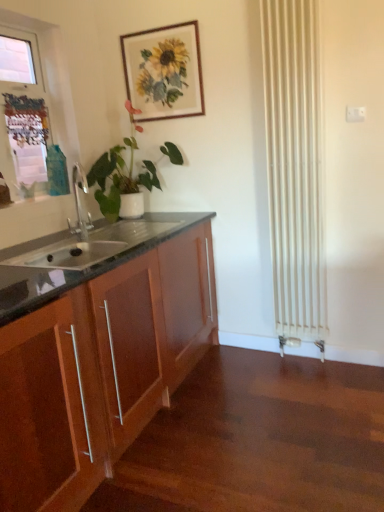
What do you see at coordinates (100, 362) in the screenshot? I see `wooden cabinet at left` at bounding box center [100, 362].

Where is `wooden picture frame at upper center`? This screenshot has width=384, height=512. wooden picture frame at upper center is located at coordinates (164, 71).

Locate an element on the screen. The image size is (384, 512). green matte plant at left is located at coordinates [119, 178].

Consider the image. Is white plastic window frame at upper left beside green matte plant at left?

No, white plastic window frame at upper left is not beside green matte plant at left.

Is white plastic window frame at upper left closer to the viewer compared to green matte plant at left?

Yes.

Does white plastic window frame at upper left turn towards green matte plant at left?

Yes, white plastic window frame at upper left is facing green matte plant at left.

How far apart are white plastic window frame at upper left and green matte plant at left?

The distance of white plastic window frame at upper left from green matte plant at left is 16.27 inches.

Find the location of a particular element. cabinetry lying in front of the white plastic window frame at upper left is located at coordinates (100, 362).

Which object is thinner, white plastic window frame at upper left or wooden cabinet at left?

white plastic window frame at upper left is thinner.

Would you say white plastic window frame at upper left is a long distance from wooden cabinet at left?

Yes.

Is white plastic window frame at upper left oriented away from wooden cabinet at left?

That's not correct — white plastic window frame at upper left is not looking away from wooden cabinet at left.

Are wooden picture frame at upper center and wooden cabinet at left beside each other?

No, wooden picture frame at upper center is not next to wooden cabinet at left.

How far apart are wooden picture frame at upper center and wooden cabinet at left?

The distance of wooden picture frame at upper center from wooden cabinet at left is 1.13 meters.

Considering the relative positions of wooden picture frame at upper center and wooden cabinet at left in the image provided, is wooden picture frame at upper center behind wooden cabinet at left?

Yes, the depth of wooden picture frame at upper center is greater than that of wooden cabinet at left.

Which is more to the right, wooden picture frame at upper center or wooden cabinet at left?

wooden picture frame at upper center is more to the right.

Is point (2, 393) positioned after point (110, 174)?

No, (2, 393) is closer to viewer.

Is wooden cabinet at left far away from green matte plant at left?

No, wooden cabinet at left is not far away from green matte plant at left.

Is wooden cabinet at left facing away from green matte plant at left?

That's not correct — wooden cabinet at left is not looking away from green matte plant at left.

How many degrees apart are the facing directions of wooden cabinet at left and green matte plant at left?

wooden cabinet at left and green matte plant at left are facing 0.514 degrees away from each other.

Find the location of a particular element. This screenshot has width=384, height=512. houseplant to the left of wooden picture frame at upper center is located at coordinates [119, 178].

Which point is more distant from viewer, (x=140, y=97) or (x=105, y=185)?

Positioned behind is point (x=140, y=97).

Who is bigger, wooden picture frame at upper center or green matte plant at left?

green matte plant at left is bigger.

From a real-world perspective, is green matte plant at left located higher than wooden picture frame at upper center?

No, from a real-world perspective, green matte plant at left is not over wooden picture frame at upper center

Does green matte plant at left have a larger size compared to wooden picture frame at upper center?

Yes.

Considering the sizes of green matte plant at left and wooden picture frame at upper center in the image, is green matte plant at left wider or thinner than wooden picture frame at upper center?

Clearly, green matte plant at left has more width compared to wooden picture frame at upper center.

Based on the photo, is green matte plant at left facing away from wooden picture frame at upper center?

That's not correct — green matte plant at left is not looking away from wooden picture frame at upper center.

Considering their positions, is green matte plant at left located in front of or behind wooden cabinet at left?

In the image, green matte plant at left appears behind wooden cabinet at left.

Choose the correct answer: Is green matte plant at left inside wooden cabinet at left or outside it?

green matte plant at left is located beyond the bounds of wooden cabinet at left.

Is point (173, 157) closer to camera compared to point (206, 219)?

Yes.

I want to click on houseplant below the white plastic window frame at upper left (from the image's perspective), so click(x=119, y=178).

You are a GUI agent. You are given a task and a screenshot of the screen. Output one action in this format:
    pyautogui.click(x=<x>, y=<y>)
    Task: Click on the window frame positioned vertically above the wooden cabinet at left (from a real-world perspective)
    The image size is (384, 512).
    Given the screenshot: What is the action you would take?
    click(42, 84)

Looking at the image, which one is located further to wooden cabinet at left, wooden picture frame at upper center or white plastic window frame at upper left?

wooden picture frame at upper center.

When comparing their distances from wooden cabinet at left, does wooden picture frame at upper center or green matte plant at left seem further?

The object further to wooden cabinet at left is wooden picture frame at upper center.

From the image, which object appears to be farther from wooden picture frame at upper center, wooden cabinet at left or white plastic window frame at upper left?

The object further to wooden picture frame at upper center is wooden cabinet at left.

When comparing their distances from white plastic window frame at upper left, does wooden picture frame at upper center or wooden cabinet at left seem further?

The object further to white plastic window frame at upper left is wooden cabinet at left.

Looking at the image, which one is located further to green matte plant at left, white plastic window frame at upper left or wooden cabinet at left?

The object further to green matte plant at left is wooden cabinet at left.

Looking at the image, which one is located further to wooden cabinet at left, green matte plant at left or wooden picture frame at upper center?

wooden picture frame at upper center is further to wooden cabinet at left.

Estimate the real-world distances between objects in this image. Which object is further from white plastic window frame at upper left, green matte plant at left or wooden cabinet at left?

wooden cabinet at left.

Looking at the image, which one is located further to wooden cabinet at left, white plastic window frame at upper left or green matte plant at left?

white plastic window frame at upper left is further to wooden cabinet at left.

You are a GUI agent. You are given a task and a screenshot of the screen. Output one action in this format:
    pyautogui.click(x=<x>, y=<y>)
    Task: Click on the houseplant between white plastic window frame at upper left and wooden picture frame at upper center from left to right
    This screenshot has height=512, width=384.
    Given the screenshot: What is the action you would take?
    pyautogui.click(x=119, y=178)

Where is `houseplant that lies between white plastic window frame at upper left and wooden cabinet at left from top to bottom`? Image resolution: width=384 pixels, height=512 pixels. houseplant that lies between white plastic window frame at upper left and wooden cabinet at left from top to bottom is located at coordinates (119, 178).

Locate an element on the screen. window frame between wooden picture frame at upper center and wooden cabinet at left in the up-down direction is located at coordinates (42, 84).

Where is `houseplant between wooden picture frame at upper center and wooden cabinet at left in the up-down direction`? houseplant between wooden picture frame at upper center and wooden cabinet at left in the up-down direction is located at coordinates (119, 178).